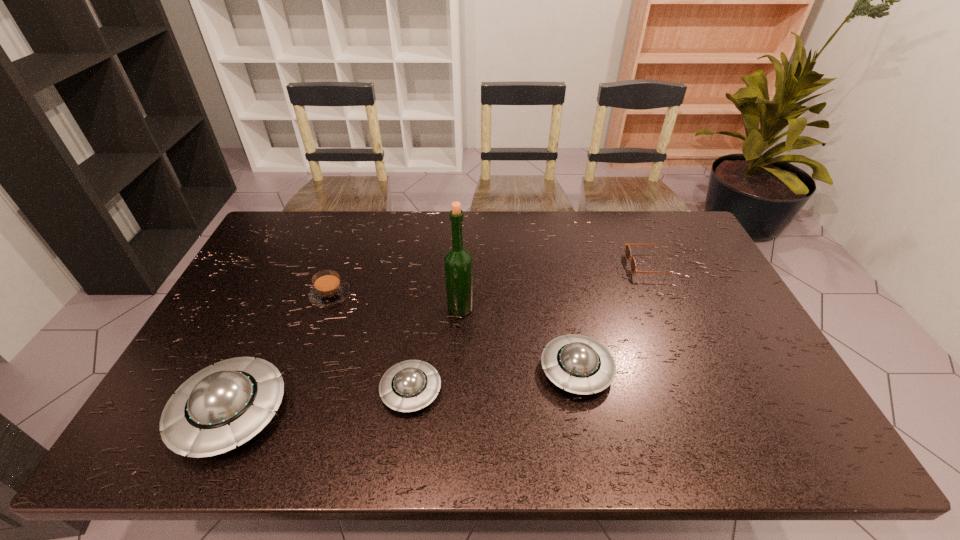
Observe the arrangement of all saucers in the image. To keep them evenly spaced, where would you place another saucer on the right? Please locate a free space. Please provide its 2D coordinates. Your answer should be formatted as a tuple, i.e. [(x, y)], where the tuple contains the x and y coordinates of a point satisfying the conditions above.

[(730, 351)]